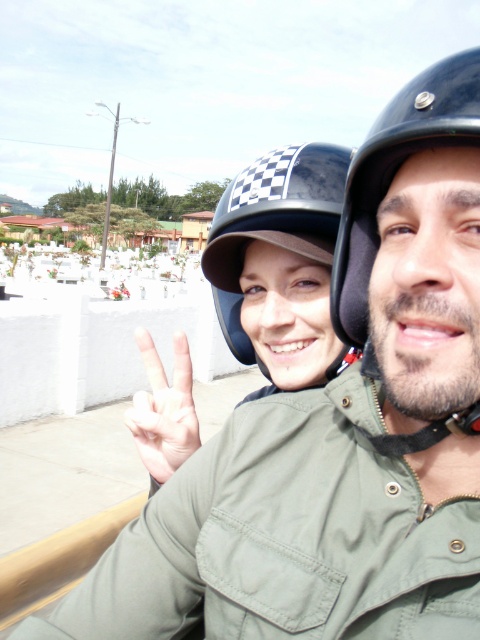
Question: Considering the real-world distances, which object is farthest from the pale skin/soft flesh hand at center?

Choices:
 (A) black matte helmet at center
 (B) checkerboard-patterned helmet at center

Answer: (A)

Question: Can you confirm if black matte helmet at center is positioned to the left of checkerboard-patterned helmet at center?

Choices:
 (A) yes
 (B) no

Answer: (B)

Question: Can you confirm if black matte helmet at center is wider than checkerboard-patterned helmet at center?

Choices:
 (A) yes
 (B) no

Answer: (B)

Question: Does checkerboard-patterned helmet at center appear on the left side of pale skin/soft flesh hand at center?

Choices:
 (A) yes
 (B) no

Answer: (B)

Question: Which object is closer to the camera taking this photo?

Choices:
 (A) black matte helmet at center
 (B) pale skin/soft flesh hand at center

Answer: (A)

Question: Based on their relative distances, which object is farther from the checkerboard-patterned helmet at center?

Choices:
 (A) pale skin/soft flesh hand at center
 (B) black matte helmet at center

Answer: (B)